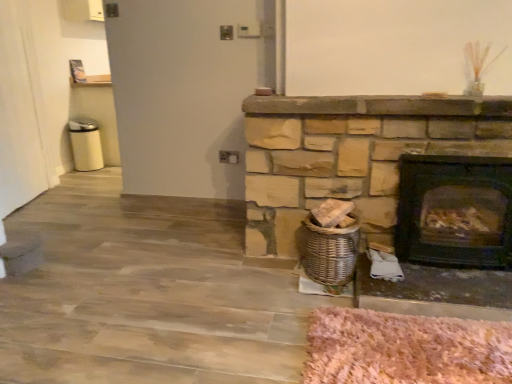
Question: Visually, is black matte wood burning stove at right positioned to the left or to the right of woven brown basket at lower center?

Choices:
 (A) left
 (B) right

Answer: (B)

Question: Considering their positions, is black matte wood burning stove at right located in front of or behind woven brown basket at lower center?

Choices:
 (A) behind
 (B) front

Answer: (B)

Question: From the image's perspective, is black matte wood burning stove at right above or below woven brown basket at lower center?

Choices:
 (A) above
 (B) below

Answer: (A)

Question: From their relative heights in the image, would you say woven brown basket at lower center is taller or shorter than black matte wood burning stove at right?

Choices:
 (A) short
 (B) tall

Answer: (A)

Question: Does point (330, 278) appear closer or farther from the camera than point (425, 190)?

Choices:
 (A) closer
 (B) farther

Answer: (A)

Question: From a real-world perspective, relative to black matte wood burning stove at right, is woven brown basket at lower center vertically above or below?

Choices:
 (A) above
 (B) below

Answer: (B)

Question: Is woven brown basket at lower center to the left or to the right of black matte wood burning stove at right in the image?

Choices:
 (A) right
 (B) left

Answer: (B)